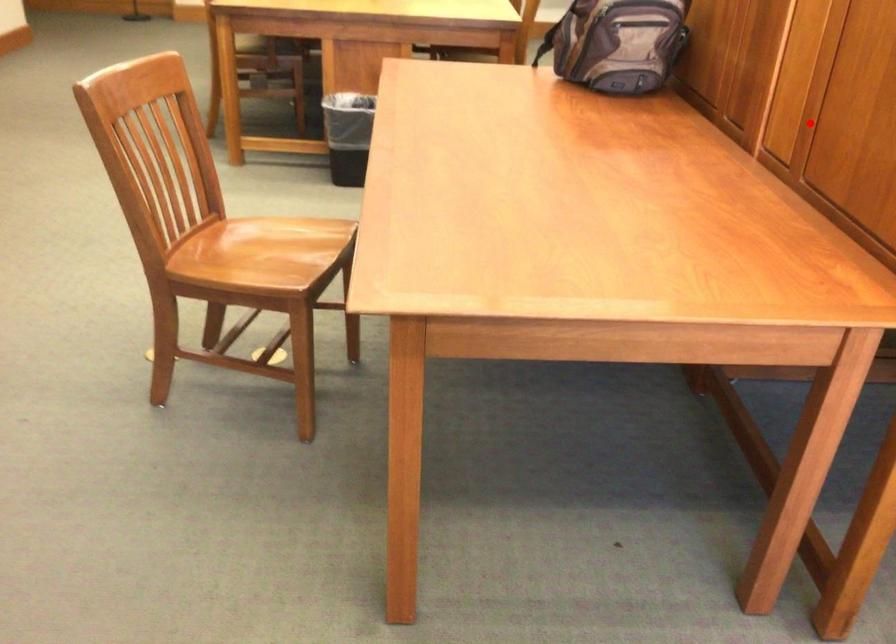
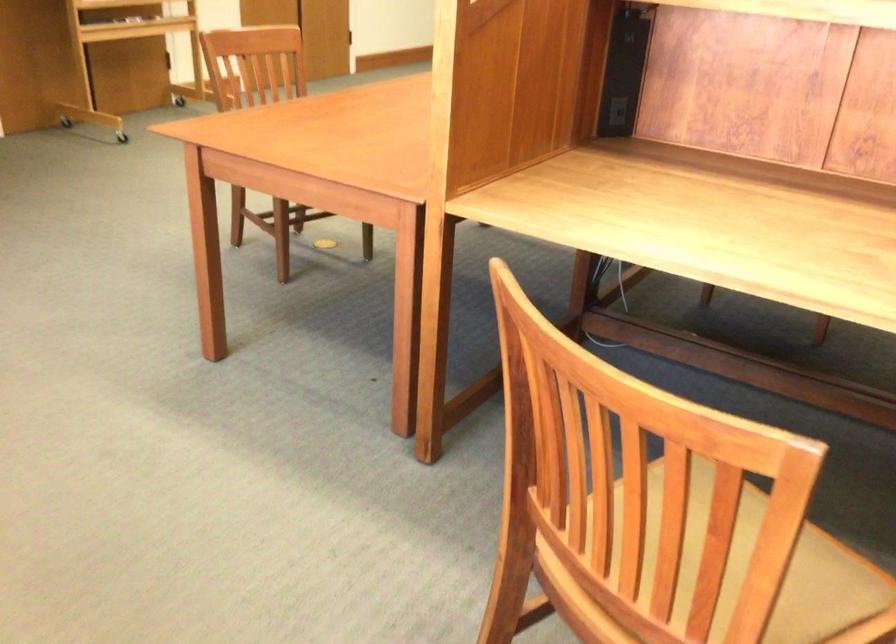
Question: I am providing you with two images of the same scene from different viewpoints. Given a red point in image1, look at the same physical point in image2. Is it:

Choices:
 (A) Closer to the viewpoint
 (B) Farther from the viewpoint

Answer: (B)